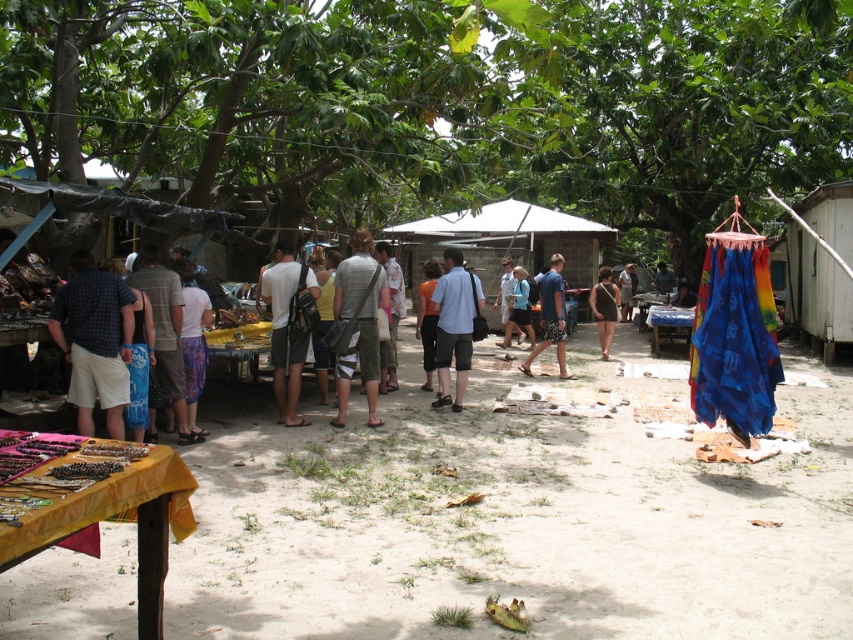
You are a customer at the market and want to buy both the light gray fabric bag at center and the black fabric dress at center. The vendor says you can only carry one item. Which item should you choose if you want to carry the larger one?

The light gray fabric bag at center is bigger than the black fabric dress at center, so you should choose the light gray fabric bag at center.

You are a customer at the outdoor market and want to pick up both the light gray fabric bag at center and the light blue fabric at center. How far apart are these two items from each other?

The light gray fabric bag at center and the light blue fabric at center are 6.13 feet apart from each other.